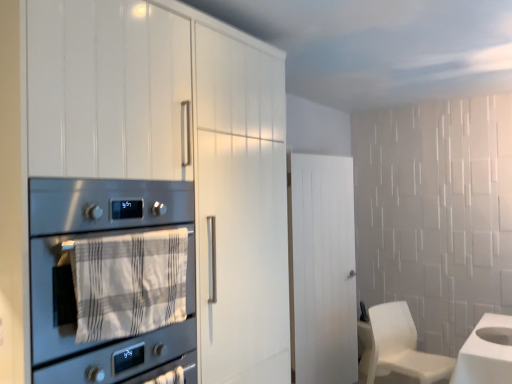
Question: Can you confirm if stainless steel oven at left is wider than white matte chair at lower right?

Choices:
 (A) yes
 (B) no

Answer: (A)

Question: Does stainless steel oven at left have a lesser width compared to white matte chair at lower right?

Choices:
 (A) no
 (B) yes

Answer: (A)

Question: Is stainless steel oven at left located outside white matte chair at lower right?

Choices:
 (A) yes
 (B) no

Answer: (A)

Question: Is stainless steel oven at left bigger than white matte chair at lower right?

Choices:
 (A) yes
 (B) no

Answer: (A)

Question: Does stainless steel oven at left contain white matte chair at lower right?

Choices:
 (A) no
 (B) yes

Answer: (A)

Question: Is stainless steel oven at left bigger or smaller than white wood door at center?

Choices:
 (A) small
 (B) big

Answer: (B)

Question: From the image's perspective, is stainless steel oven at left above or below white wood door at center?

Choices:
 (A) below
 (B) above

Answer: (B)

Question: Considering the relative positions of stainless steel oven at left and white wood door at center in the image provided, is stainless steel oven at left to the left or to the right of white wood door at center?

Choices:
 (A) right
 (B) left

Answer: (B)

Question: Would you say stainless steel oven at left is inside or outside white wood door at center?

Choices:
 (A) inside
 (B) outside

Answer: (B)

Question: From a real-world perspective, is stainless steel oven at left physically located above or below white matte cabinet at left?

Choices:
 (A) below
 (B) above

Answer: (A)

Question: Based on their positions, is stainless steel oven at left located to the left or right of white matte cabinet at left?

Choices:
 (A) right
 (B) left

Answer: (B)

Question: In terms of height, does stainless steel oven at left look taller or shorter compared to white matte cabinet at left?

Choices:
 (A) short
 (B) tall

Answer: (A)

Question: Which is correct: stainless steel oven at left is inside white matte cabinet at left, or outside of it?

Choices:
 (A) outside
 (B) inside

Answer: (B)

Question: Is white wood door at center spatially inside white matte chair at lower right, or outside of it?

Choices:
 (A) inside
 (B) outside

Answer: (B)

Question: In the image, is white wood door at center on the left side or the right side of white matte chair at lower right?

Choices:
 (A) right
 (B) left

Answer: (B)